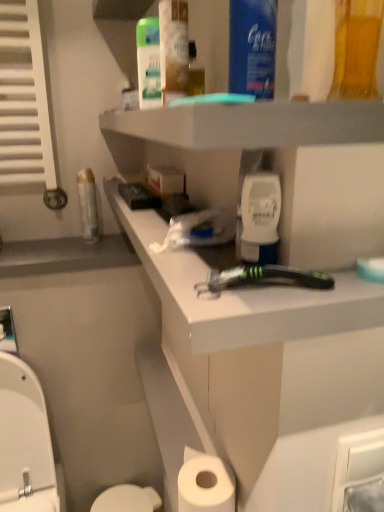
Question: Is white matte toilet paper at lower center thinner than white plastic razor at center?

Choices:
 (A) no
 (B) yes

Answer: (B)

Question: Is white matte toilet paper at lower center oriented away from white plastic razor at center?

Choices:
 (A) yes
 (B) no

Answer: (B)

Question: Considering the relative sizes of white matte toilet paper at lower center and white plastic razor at center in the image provided, is white matte toilet paper at lower center shorter than white plastic razor at center?

Choices:
 (A) no
 (B) yes

Answer: (A)

Question: Is white matte toilet paper at lower center oriented towards white plastic razor at center?

Choices:
 (A) yes
 (B) no

Answer: (B)

Question: Would you say white plastic razor at center is part of white matte toilet paper at lower center's contents?

Choices:
 (A) no
 (B) yes

Answer: (A)

Question: Is clear plastic bottle at left, the 1th mouthwash viewed from the back, in front of or behind black plastic razor at center in the image?

Choices:
 (A) behind
 (B) front

Answer: (A)

Question: From the image's perspective, is clear plastic bottle at left, the 5th mouthwash viewed from the front, located above or below black plastic razor at center?

Choices:
 (A) below
 (B) above

Answer: (B)

Question: From their relative heights in the image, would you say clear plastic bottle at left, which is the 1th mouthwash in left-to-right order, is taller or shorter than black plastic razor at center?

Choices:
 (A) short
 (B) tall

Answer: (B)

Question: From a real-world perspective, is clear plastic bottle at left, the fifth mouthwash when ordered from right to left, positioned above or below black plastic razor at center?

Choices:
 (A) above
 (B) below

Answer: (B)

Question: Visually, is white matte mouthwash at center, which ranks as the 3th mouthwash in front-to-back order, positioned to the left or to the right of white plastic toilet seat at lower left?

Choices:
 (A) left
 (B) right

Answer: (B)

Question: From the image's perspective, is white matte mouthwash at center, which is the third mouthwash in back-to-front order, located above or below white plastic toilet seat at lower left?

Choices:
 (A) below
 (B) above

Answer: (B)

Question: Is white matte mouthwash at center, the fourth mouthwash in the left-to-right sequence, in front of or behind white plastic toilet seat at lower left in the image?

Choices:
 (A) front
 (B) behind

Answer: (A)

Question: Is point (269, 262) positioned closer to the camera than point (31, 442)?

Choices:
 (A) closer
 (B) farther

Answer: (A)

Question: Relative to blue plastic mouthwash at upper center, placed as the 4th mouthwash when sorted from back to front, is white glossy toilet bowl at lower left in front or behind?

Choices:
 (A) front
 (B) behind

Answer: (B)

Question: Is point (152, 494) closer or farther from the camera than point (259, 0)?

Choices:
 (A) farther
 (B) closer

Answer: (A)